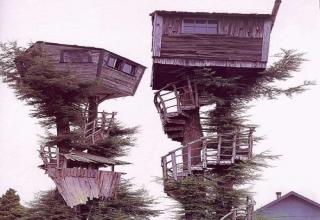
I want to click on floor, so click(83, 89), click(180, 69).